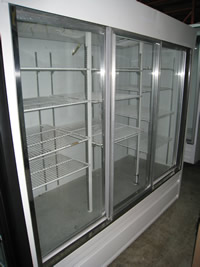
Find the location of a particular element. The height and width of the screenshot is (267, 200). ceiling of fridge is located at coordinates (61, 25).